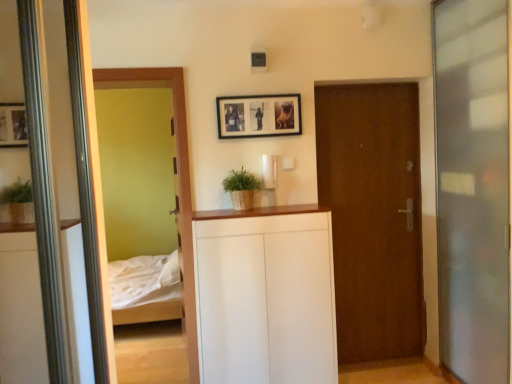
The image size is (512, 384). What are the coordinates of `vacant space in front of brown wooden door at center` in the screenshot? It's located at (380, 374).